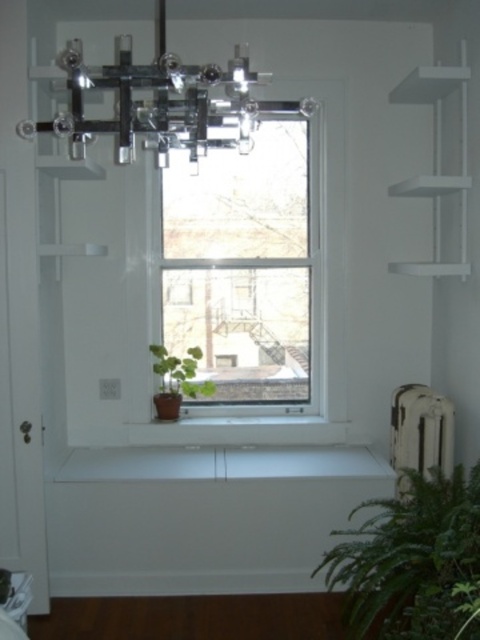
Is green leafy plant at lower right wider than white matte shelf at upper right?

Yes, green leafy plant at lower right is wider than white matte shelf at upper right.

Based on the photo, is green leafy plant at lower right closer to the viewer compared to white matte shelf at upper right?

That is True.

Between point (427, 570) and point (447, 74), which one is positioned in front?

Point (427, 570) is more forward.

In order to click on green leafy plant at lower right in this screenshot , I will do `click(414, 561)`.

Is clear glass window at center to the left of white matte shelf at upper right from the viewer's perspective?

Yes, clear glass window at center is to the left of white matte shelf at upper right.

Looking at this image, does clear glass window at center have a larger size compared to white matte shelf at upper right?

Yes.

This screenshot has width=480, height=640. What are the coordinates of `clear glass window at center` in the screenshot? It's located at (244, 262).

The image size is (480, 640). Identify the location of white matte shelf at upper right. (437, 161).

Find the location of a particular element. This screenshot has width=480, height=640. white matte shelf at upper right is located at coordinates tap(437, 161).

This screenshot has width=480, height=640. Find the location of `white matte shelf at upper right`. white matte shelf at upper right is located at coordinates (437, 161).